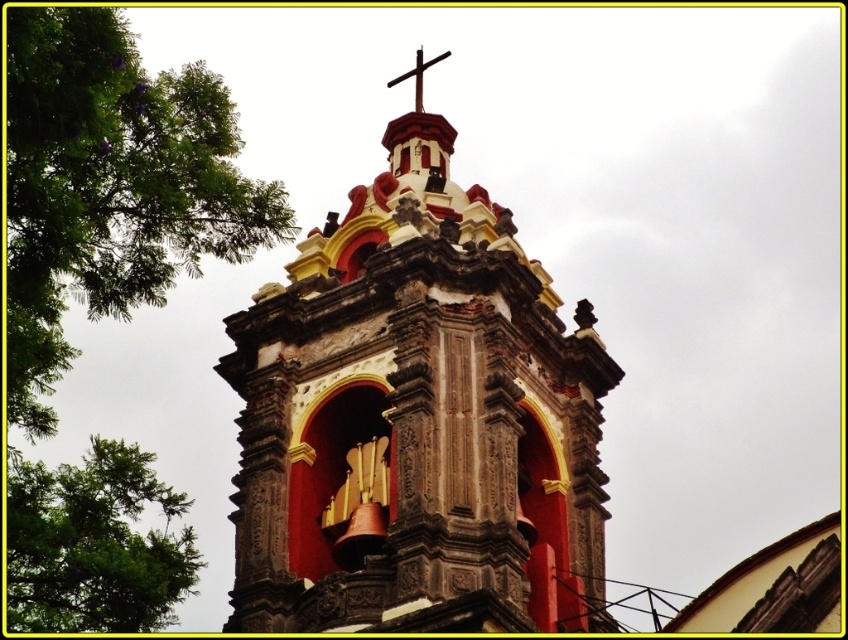
Does red stone bell tower at center have a smaller size compared to green leafy tree at lower left?

Incorrect, red stone bell tower at center is not smaller in size than green leafy tree at lower left.

Does red stone bell tower at center have a greater height compared to green leafy tree at lower left?

Yes.

Is point (584, 362) positioned after point (48, 547)?

Yes, it is behind point (48, 547).

This screenshot has width=848, height=640. Find the location of `red stone bell tower at center`. red stone bell tower at center is located at coordinates (417, 420).

Consider the image. Is red stone bell tower at center bigger than smooth wooden cross at upper center?

Correct, red stone bell tower at center is larger in size than smooth wooden cross at upper center.

Is point (335, 316) more distant than point (402, 80)?

No, it is in front of (402, 80).

Does point (314, 577) come farther from viewer compared to point (394, 81)?

No.

The width and height of the screenshot is (848, 640). I want to click on red stone bell tower at center, so click(417, 420).

Can you confirm if green leafy tree at lower left is shorter than smooth wooden cross at upper center?

In fact, green leafy tree at lower left may be taller than smooth wooden cross at upper center.

Which is above, green leafy tree at lower left or smooth wooden cross at upper center?

smooth wooden cross at upper center

Is point (32, 556) positioned after point (421, 100)?

No.

Where is `green leafy tree at lower left`? The height and width of the screenshot is (640, 848). green leafy tree at lower left is located at coordinates (93, 545).